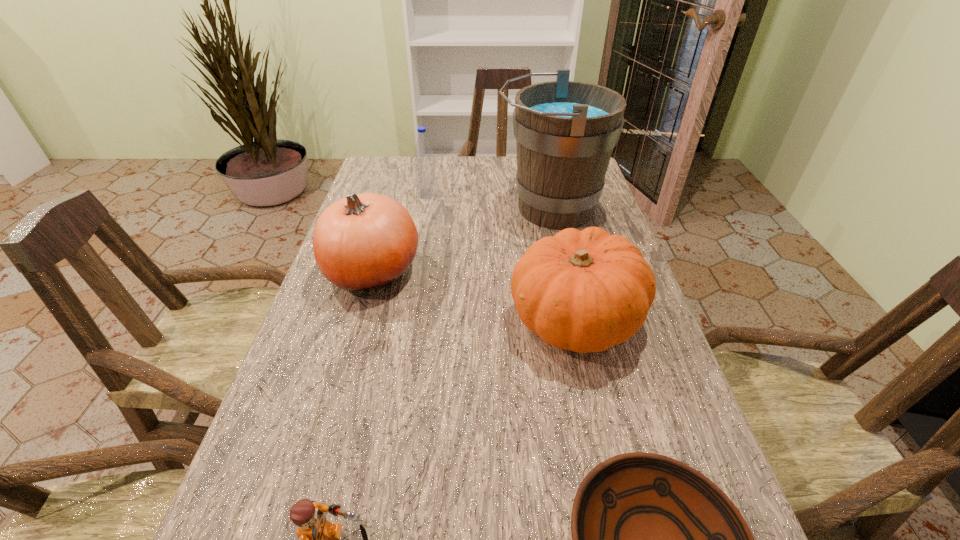
Where is `empty space that is in between the left pumpkin and the tallest object`? Image resolution: width=960 pixels, height=540 pixels. empty space that is in between the left pumpkin and the tallest object is located at coordinates (462, 239).

Where is `vacant area that lies between the water bottle and the right pumpkin`? vacant area that lies between the water bottle and the right pumpkin is located at coordinates (501, 256).

At what (x,y) coordinates should I click in order to perform the action: click on empty space between the water bottle and the tallest object. Please return your answer as a coordinate pair (x, y). Looking at the image, I should click on (489, 201).

Choose which object is the fourth nearest neighbor to the taller pumpkin. Please provide its 2D coordinates. Your answer should be formatted as a tuple, i.e. [(x, y)], where the tuple contains the x and y coordinates of a point satisfying the conditions above.

[(317, 537)]

Locate an element on the screen. This screenshot has width=960, height=540. the fifth closest object to the fifth tallest object is located at coordinates (425, 175).

Locate an element on the screen. This screenshot has width=960, height=540. blank space that satisfies the following two spatial constraints: 1. on the back side of the left pumpkin; 2. on the left side of the water bottle is located at coordinates (395, 193).